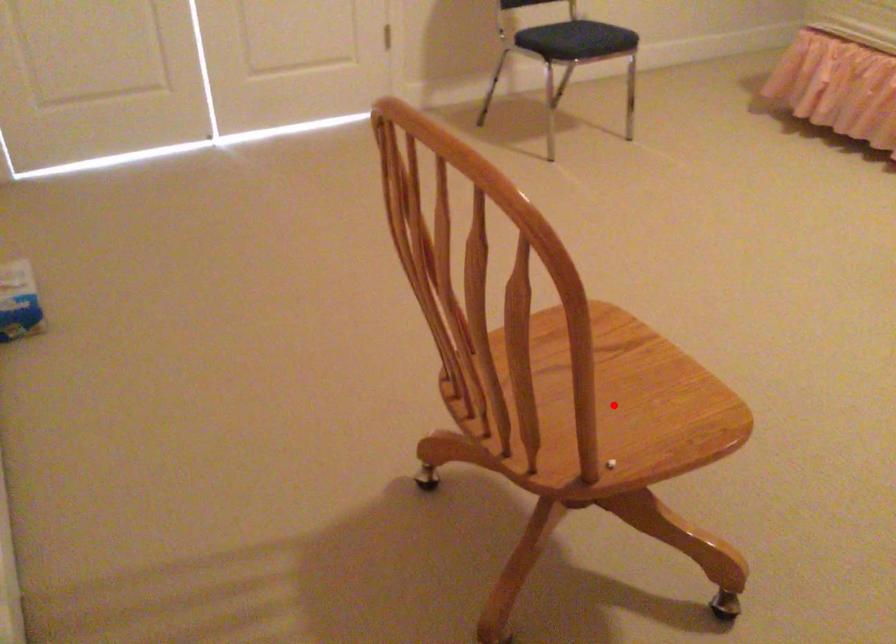
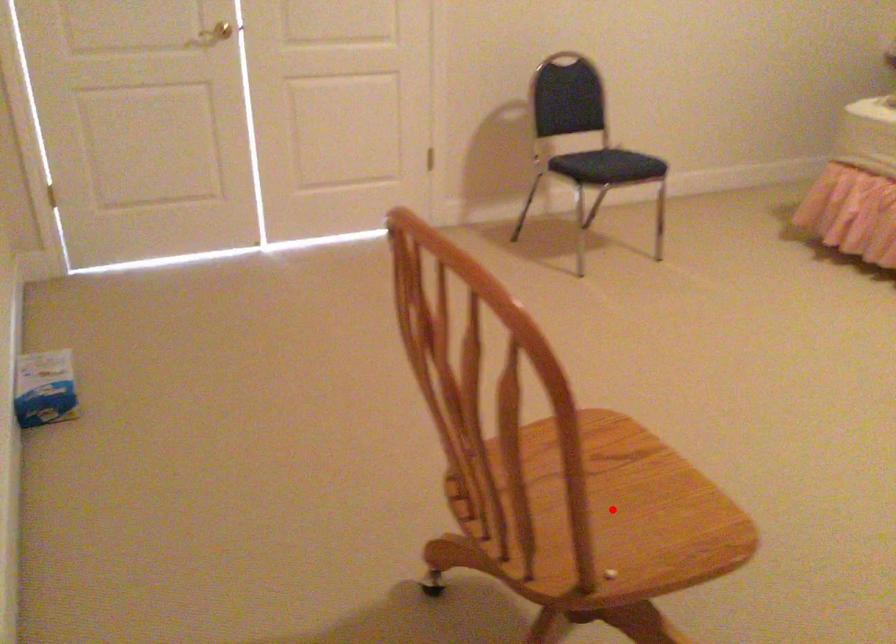
Consider the image. I am providing you with two images of the same scene from different viewpoints. A red point is marked on the first image and another point is marked on the second image. Is the marked point in image1 the same physical position as the marked point in image2?

Yes